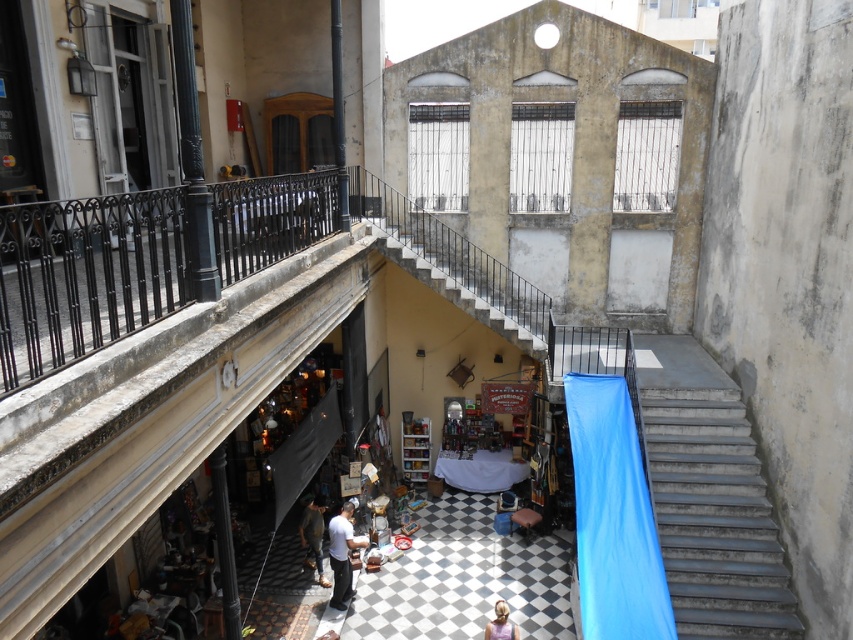
Between light brown leather pants at center and light brown hair at lower center, which one has more height?

With more height is light brown leather pants at center.

Between light brown leather pants at center and light brown hair at lower center, which one appears on the right side from the viewer's perspective?

Positioned to the right is light brown hair at lower center.

Which is behind, point (346, 584) or point (488, 636)?

Positioned behind is point (346, 584).

Identify the location of light brown leather pants at center. (341, 554).

Is checkerboard tile floor at center smaller than light brown hair at lower center?

No, checkerboard tile floor at center is not smaller than light brown hair at lower center.

Which is behind, point (350, 620) or point (508, 620)?

Positioned behind is point (350, 620).

Where is `checkerboard tile floor at center`? This screenshot has width=853, height=640. checkerboard tile floor at center is located at coordinates (461, 579).

Is point (741, 618) positioned in front of point (344, 518)?

Yes, it is.

Is metallic gray stairs at right shorter than light brown leather pants at center?

No.

Describe the element at coordinates (715, 516) in the screenshot. I see `metallic gray stairs at right` at that location.

The height and width of the screenshot is (640, 853). Identify the location of metallic gray stairs at right. (715, 516).